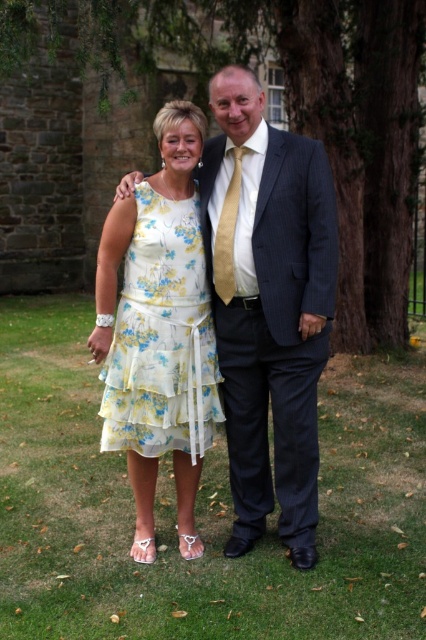
You are a photographer at a formal event and need to frame a shot that includes both the brown textured tree trunk at center right and the floral cotton dress at center. Which object should you adjust your camera angle to prioritize in terms of width?

The brown textured tree trunk at center right is wider than the floral cotton dress at center, so you should prioritize framing the brown textured tree trunk at center right to accommodate its greater width.

You are a photographer holding a camera at center left. You want to take a photo of the brown textured tree trunk at center right. Can you fit the entire tree trunk into your camera frame if your camera has a maximum viewing angle of 60 degrees?

The distance between the camera and the brown textured tree trunk at center right is 7.05 meters. To determine if the tree trunk fits within the 60 degree viewing angle, we can use trigonometry. Assuming the tree trunk is the opposite side and half the angle is 30 degrees, tan 30 equals opposite over adjacent. The maximum width that can be captured is 2 times 7.05 multiplied by tan 30. Calculating this gives approximately 2.7 meters. If the tree trunk is narrower than 2.7 meters, it will fit. However, since

You are a photographer at the event and need to ensure both the brown textured tree trunk at center right and the dark blue pinstripe suit at center are visible in your photo. Based on their positions, which object should you focus on first to capture both in the frame?

The brown textured tree trunk at center right is located above the dark blue pinstripe suit at center, so you should focus on the dark blue pinstripe suit at center first to ensure both are within the frame.